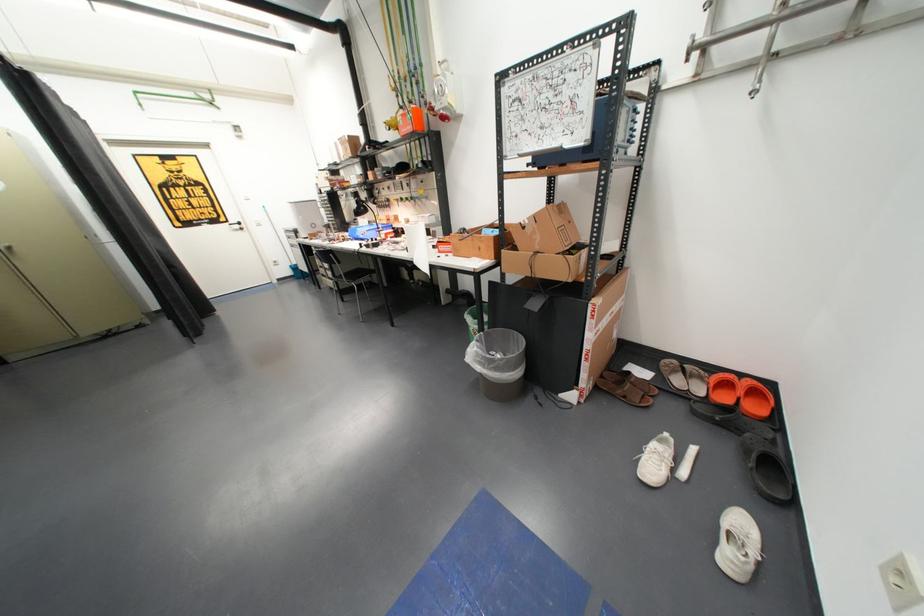
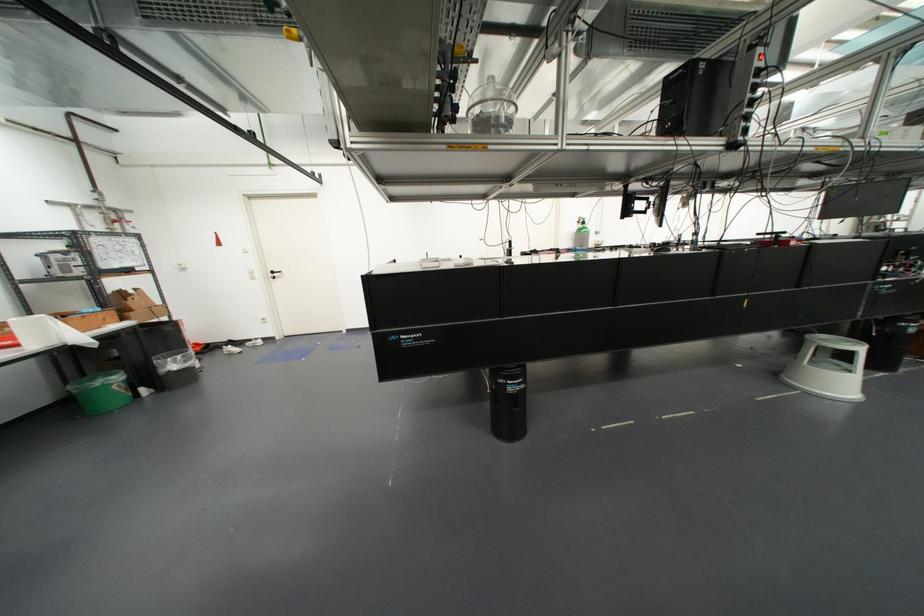
Locate, in the second image, the point that corresponds to pixel 469 329 in the first image.

(113, 387)